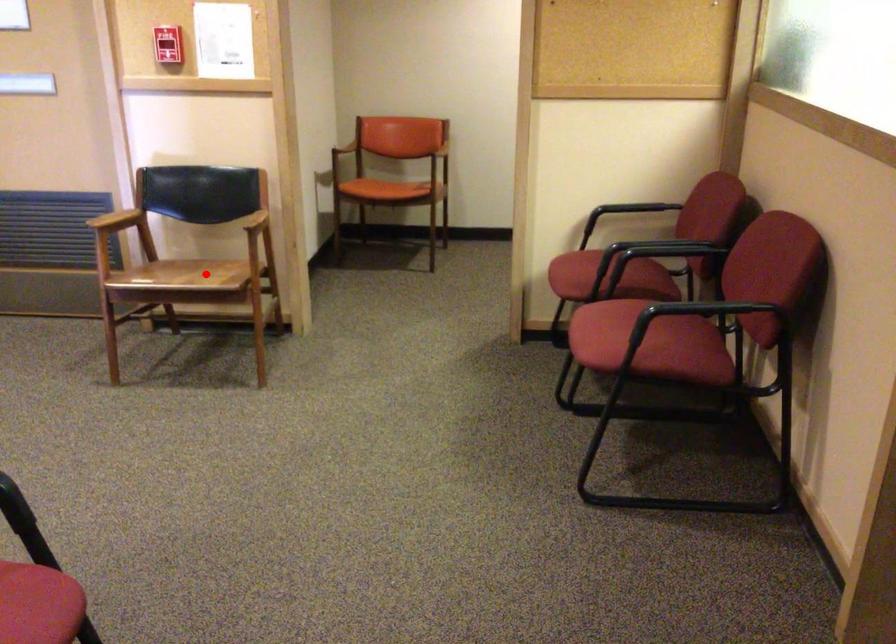
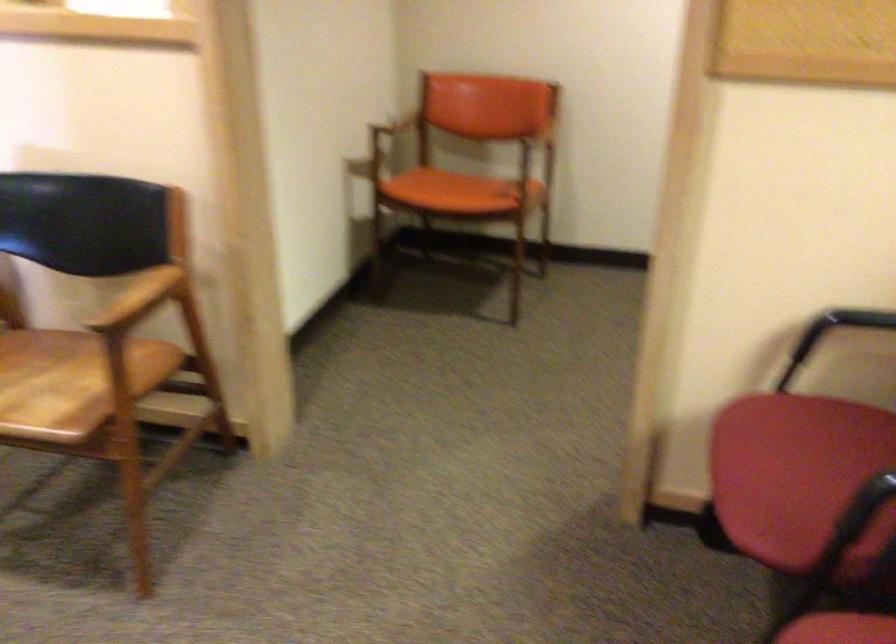
Question: I am providing you with two images of the same scene from different viewpoints. In image1, a red point is highlighted. Considering the same 3D point in image2, which of the following is correct?

Choices:
 (A) It is closer
 (B) It is farther

Answer: (A)